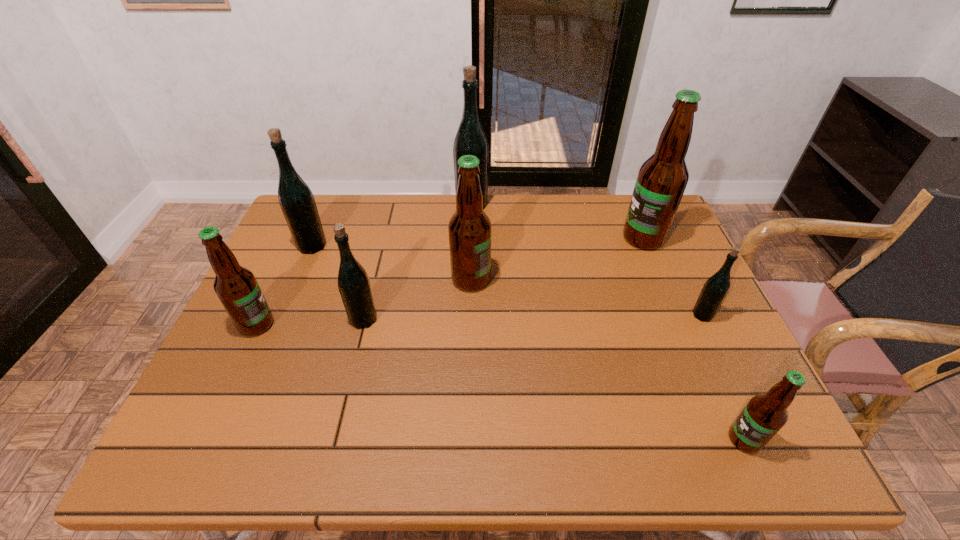
At what (x,y) coordinates should I click in order to perform the action: click on free point at the far edge. Please return your answer as a coordinate pair (x, y). The image size is (960, 540). Looking at the image, I should click on (612, 221).

Identify the location of free space at the near edge of the desktop. (455, 460).

In the image, there is a desktop. Identify the location of vacant region at the left edge. This screenshot has height=540, width=960. (278, 382).

I want to click on blank space at the right edge, so click(x=688, y=346).

The width and height of the screenshot is (960, 540). Find the location of `free space that is in between the smallest brown beer bottle and the biggest brown beer bottle`. free space that is in between the smallest brown beer bottle and the biggest brown beer bottle is located at coordinates (694, 339).

Locate an element on the screen. The width and height of the screenshot is (960, 540). free spot between the second biggest green beer bottle and the biggest green beer bottle is located at coordinates (392, 225).

Find the location of a particular element. vacant space that is in between the leftmost green beer bottle and the rightmost green beer bottle is located at coordinates (507, 280).

The width and height of the screenshot is (960, 540). What are the coordinates of `blank region between the biggest green beer bottle and the farthest brown beer bottle` in the screenshot? It's located at (558, 221).

Identify the location of blank region between the farthest green beer bottle and the farthest brown beer bottle. (558, 221).

Find the location of a particular element. empty space between the rightmost green beer bottle and the leftmost green beer bottle is located at coordinates (507, 280).